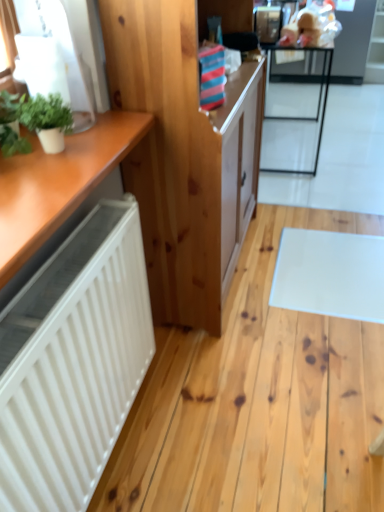
You are a GUI agent. You are given a task and a screenshot of the screen. Output one action in this format:
    pyautogui.click(x=<x>, y=<y>)
    Task: Click on the free space in front of metallic black table at upper right
    The height and width of the screenshot is (512, 384).
    Given the screenshot: What is the action you would take?
    pyautogui.click(x=327, y=185)